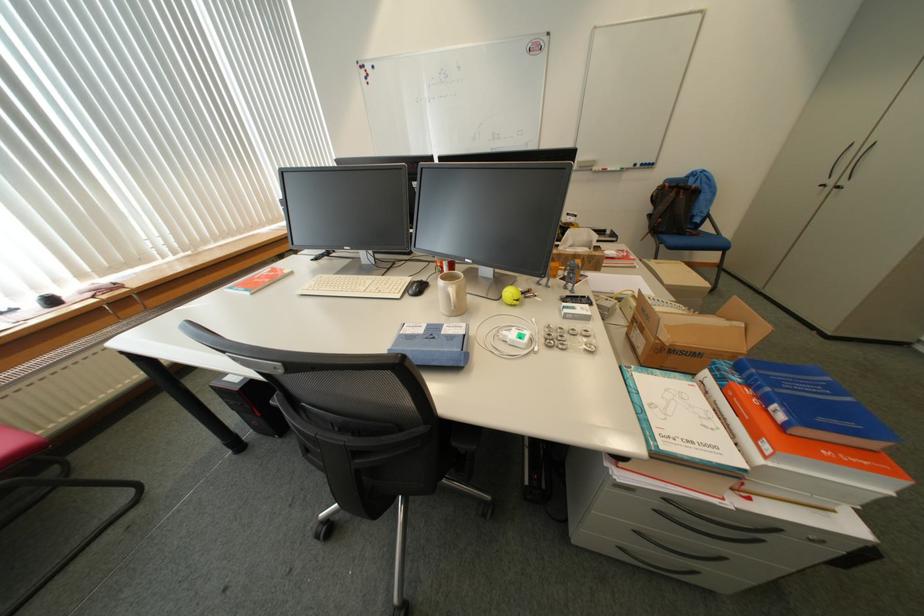
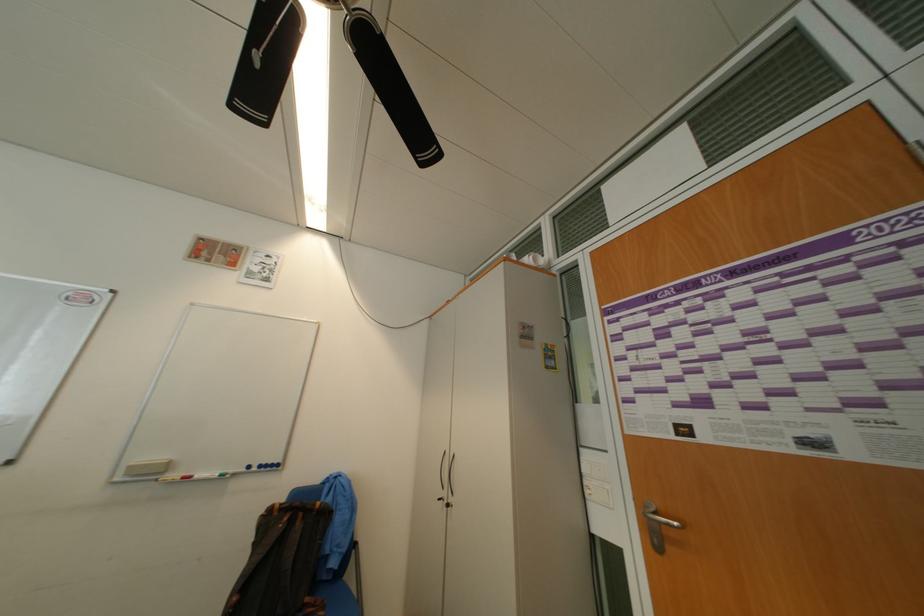
Find the pixel in the second image that matches [832,187] in the first image.

(448, 501)